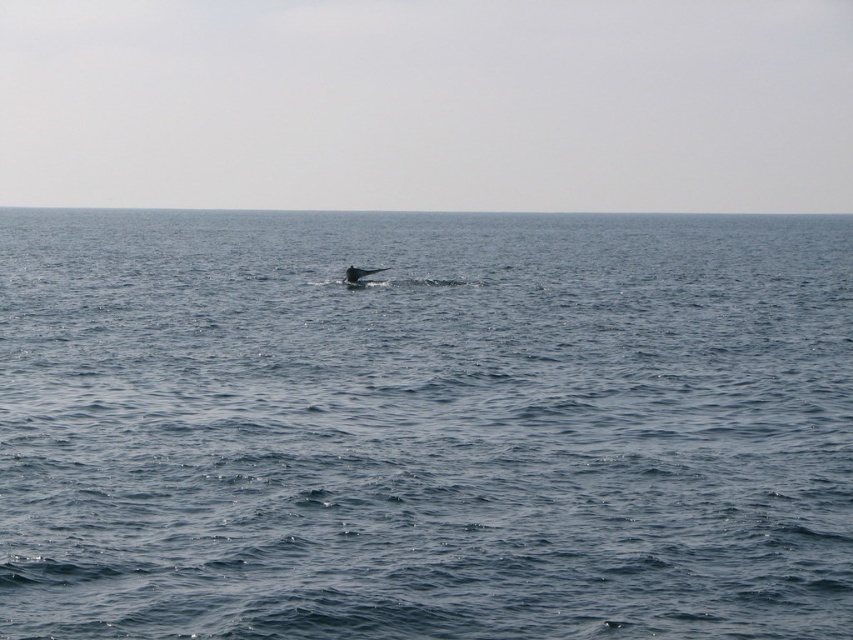
You are a marine biologist observing the scene. You notice the blue water at center and the gray matte whale at center. Which object is positioned higher in the image?

The blue water at center is positioned higher than the gray matte whale at center.